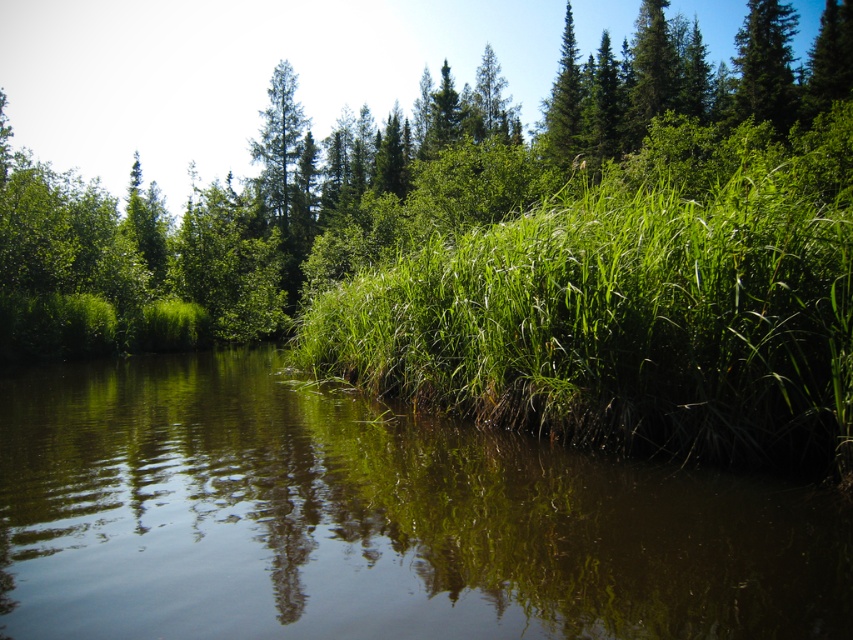
Who is more distant from viewer, (38, 236) or (763, 96)?

The point (763, 96) is behind.

Between point (653, 108) and point (793, 99), which one is positioned behind?

Point (653, 108)

Locate an element on the screen. The image size is (853, 640). green leafy shrub at center is located at coordinates (387, 186).

Between green grassy at center and green matte tree at upper right, which one is positioned lower?

green grassy at center is lower down.

Identify the location of green grassy at center. This screenshot has width=853, height=640. [x=619, y=324].

Is green grassy river at center further to the viewer compared to green grassy at center?

No, green grassy river at center is in front of green grassy at center.

Which is in front, point (256, 579) or point (726, 403)?

Point (256, 579) is in front.

The width and height of the screenshot is (853, 640). Describe the element at coordinates (373, 518) in the screenshot. I see `green grassy river at center` at that location.

At what (x,y) coordinates should I click in order to perform the action: click on green grassy river at center. Please return your answer as a coordinate pair (x, y). Looking at the image, I should click on (373, 518).